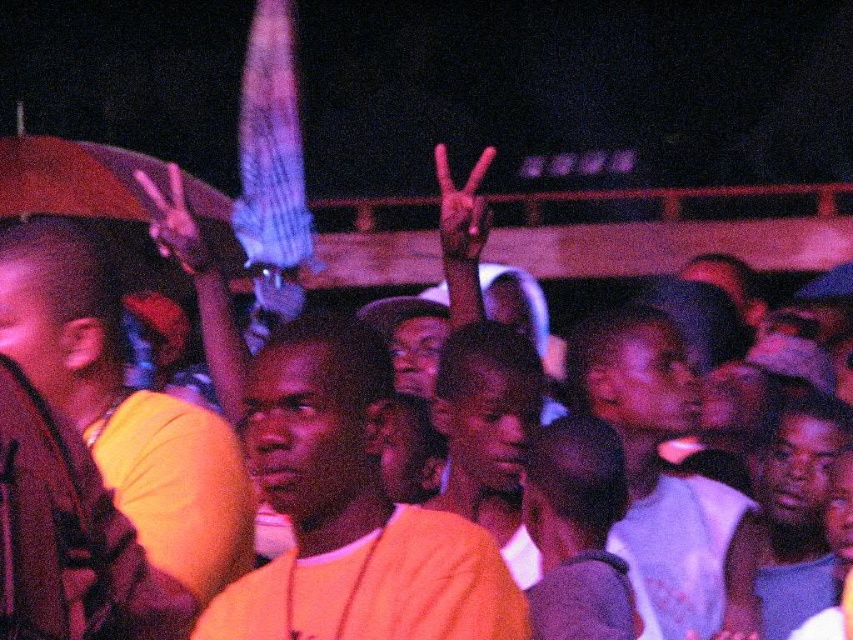
Is orange cotton shirt at center bigger than white cotton shirt at center?

No.

Find the location of a particular element. Image resolution: width=853 pixels, height=640 pixels. orange cotton shirt at center is located at coordinates (350, 509).

The image size is (853, 640). I want to click on orange cotton shirt at center, so click(350, 509).